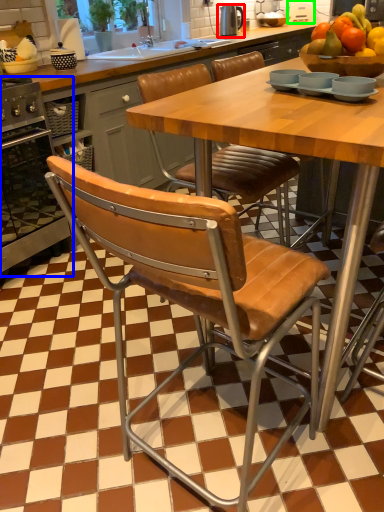
Question: Estimate the real-world distances between objects in this image. Which object is closer to appliance (highlighted by a red box), oven (highlighted by a blue box) or appliance (highlighted by a green box)?

Choices:
 (A) oven
 (B) appliance

Answer: (B)